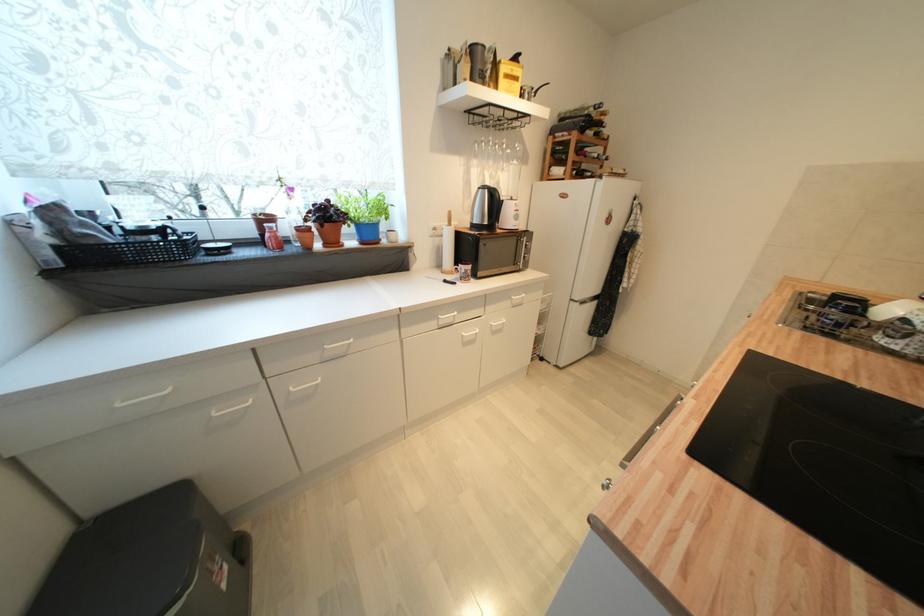
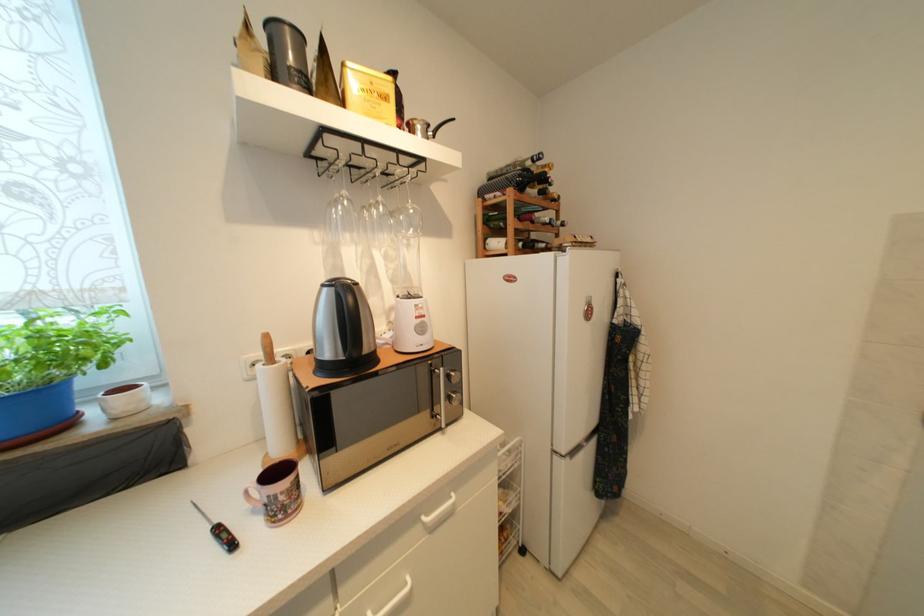
In the second image, find the point that corresponds to pixel 597 179 in the first image.

(553, 251)